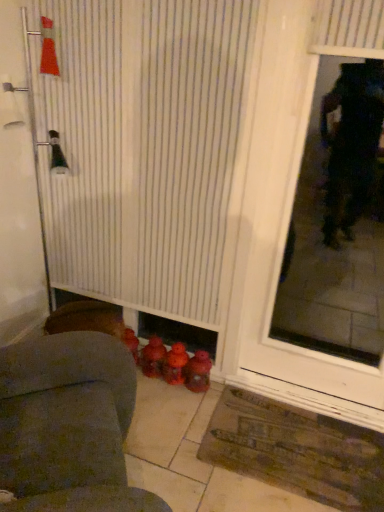
Question: Does point (372, 124) appear closer or farther from the camera than point (125, 125)?

Choices:
 (A) farther
 (B) closer

Answer: (A)

Question: From a real-world perspective, is transparent glass door at right above or below white striped shower curtain at lower center?

Choices:
 (A) above
 (B) below

Answer: (A)

Question: Based on their relative distances, which object is farther from the rubberized plastic toy at lower center, the 2th toy when ordered from left to right?

Choices:
 (A) brown textured mat at lower right
 (B) white textured door at left
 (C) rubberized plastic toy at center, which is the 3th toy in right-to-left order
 (D) transparent glass door at right
 (E) rubberized red toy at lower center, the first toy positioned from the right

Answer: (D)

Question: Which is farther from the velvet gray armchair at lower left?

Choices:
 (A) transparent glass door at right
 (B) rubberized red toy at lower center, the first toy positioned from the right
 (C) white textured door at left
 (D) brown textured mat at lower right
 (E) white striped shower curtain at lower center

Answer: (A)